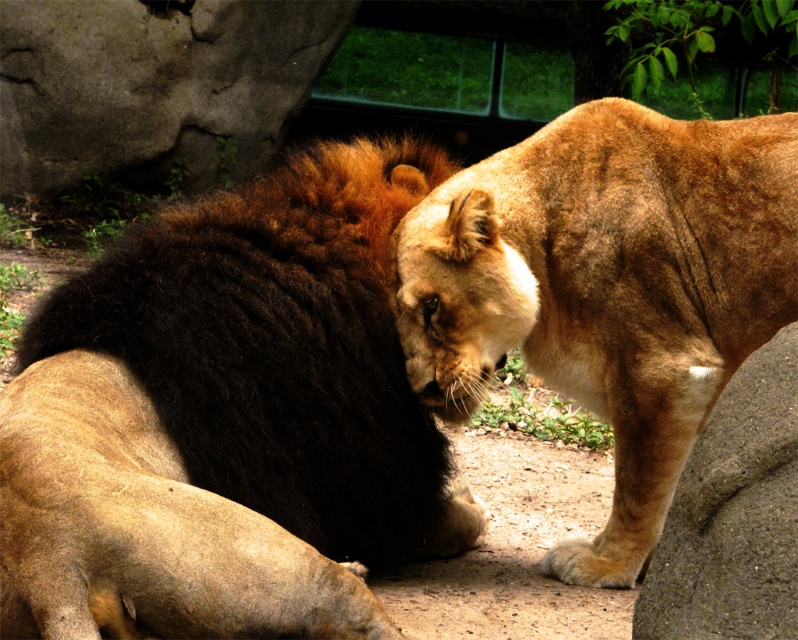
Question: Which object is closer to the camera taking this photo?

Choices:
 (A) dark brown fur lion at center
 (B) golden fur lion at center

Answer: (A)

Question: Can you confirm if dark brown fur lion at center is positioned to the left of golden fur lion at center?

Choices:
 (A) no
 (B) yes

Answer: (B)

Question: Is the position of dark brown fur lion at center more distant than that of golden fur lion at center?

Choices:
 (A) yes
 (B) no

Answer: (B)

Question: Which point appears farthest from the camera in this image?

Choices:
 (A) (41, 422)
 (B) (607, 172)

Answer: (B)

Question: Can you confirm if dark brown fur lion at center is positioned below golden fur lion at center?

Choices:
 (A) yes
 (B) no

Answer: (A)